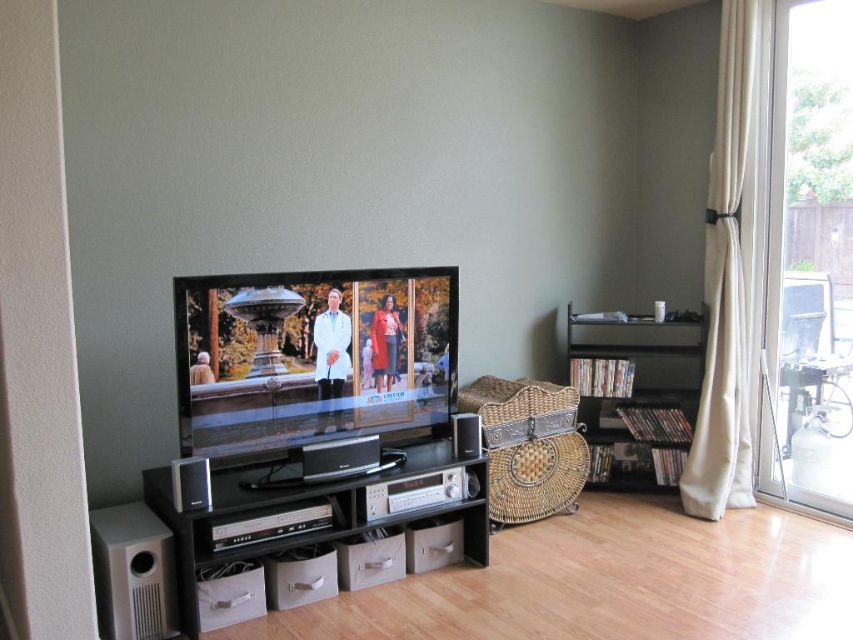
You are a delivery person who just arrived with a new bookshelf that is 4 feet wide. The current black matte bookshelf at right is to be replaced. Can you slide the new bookshelf into place without moving the flat screen tv at center?

The distance between the flat screen tv at center and the black matte bookshelf at right is 4.43 feet. Since the new bookshelf is 4 feet wide, it can be slid into place as the available space is wider than the bookshelf.

You are moving a large rectangular box that is 1.2 meters wide. You need to pass through the transparent glass door at right and then place it next to the black matte entertainment center at lower center. Will the box fit through the door?

The transparent glass door at right has a width less than the black matte entertainment center at lower center. Since the box is 1.2 meters wide, it may not fit through the door if the door is narrower than the box. However, without knowing the exact width of the door, we cannot definitively determine if it will fit. Please measure the door width before attempting to move the box.

You are moving a large sofa that is 7 feet long into the living room. You need to place it between the flat screen tv at center and the transparent glass door at right. Is there enough space for the sofa to fit?

The distance between the flat screen tv at center and the transparent glass door at right is 6.93 feet, which is slightly less than the 7 feet length of the sofa. Therefore, there is not enough space to fit the sofa between them.